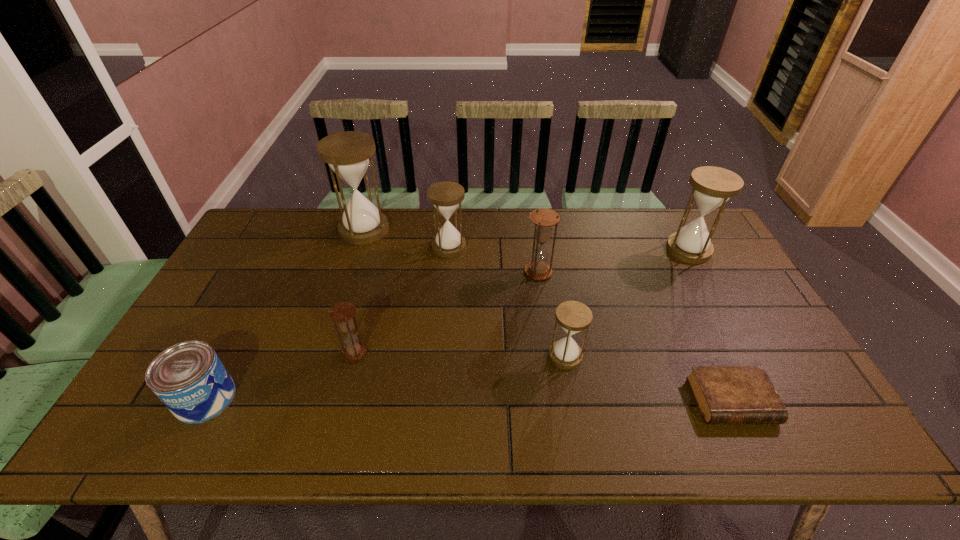
The width and height of the screenshot is (960, 540). I want to click on free location located on the back of the nearer brown hourglass, so click(370, 295).

I want to click on can present at the near edge, so click(189, 378).

Identify the location of diary that is at the near edge. This screenshot has height=540, width=960. (724, 394).

Locate an element on the screen. The height and width of the screenshot is (540, 960). object at the left edge is located at coordinates (189, 378).

Where is `hourglass at the right edge`? hourglass at the right edge is located at coordinates (712, 186).

Identify the location of diary that is at the right edge. (724, 394).

Image resolution: width=960 pixels, height=540 pixels. In order to click on object located at the near left corner in this screenshot , I will do `click(189, 378)`.

Find the location of a particular element. object that is positioned at the far right corner is located at coordinates (712, 186).

Find the location of `object present at the near right corner`. object present at the near right corner is located at coordinates (724, 394).

The image size is (960, 540). In the image, there is a desktop. In order to click on vacant space at the far edge in this screenshot , I will do `click(528, 238)`.